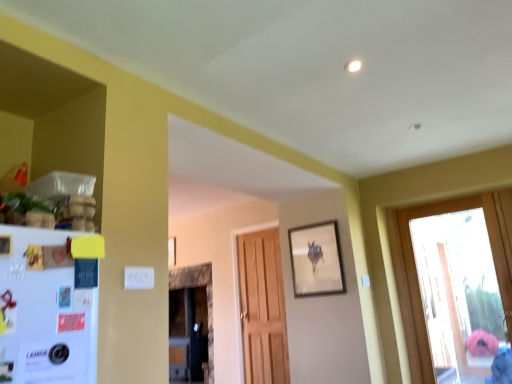
Question: Is transparent glass door at right bigger than white matte refrigerator at left?

Choices:
 (A) no
 (B) yes

Answer: (B)

Question: From a real-world perspective, is transparent glass door at right below white matte refrigerator at left?

Choices:
 (A) yes
 (B) no

Answer: (A)

Question: Is white matte refrigerator at left inside transparent glass door at right?

Choices:
 (A) yes
 (B) no

Answer: (B)

Question: From the image's perspective, is transparent glass door at right beneath white matte refrigerator at left?

Choices:
 (A) no
 (B) yes

Answer: (B)

Question: Is transparent glass door at right completely or partially outside of white matte refrigerator at left?

Choices:
 (A) no
 (B) yes

Answer: (B)

Question: Is transparent glass door at right smaller than white matte refrigerator at left?

Choices:
 (A) no
 (B) yes

Answer: (A)

Question: Is the depth of white matte refrigerator at left greater than that of matte wooden picture frame at center, placed as the first picture frame when sorted from left to right?

Choices:
 (A) no
 (B) yes

Answer: (A)

Question: Can you confirm if white matte refrigerator at left is wider than matte wooden picture frame at center, the second picture frame when ordered from right to left?

Choices:
 (A) yes
 (B) no

Answer: (A)

Question: Does white matte refrigerator at left have a lesser width compared to matte wooden picture frame at center, the second picture frame when ordered from right to left?

Choices:
 (A) yes
 (B) no

Answer: (B)

Question: Can you confirm if white matte refrigerator at left is positioned to the left of matte wooden picture frame at center, placed as the first picture frame when sorted from left to right?

Choices:
 (A) yes
 (B) no

Answer: (B)

Question: Is white matte refrigerator at left to the right of matte wooden picture frame at center, which ranks as the 2th picture frame in front-to-back order, from the viewer's perspective?

Choices:
 (A) yes
 (B) no

Answer: (A)

Question: Is white matte refrigerator at left in front of matte wooden picture frame at center, which ranks as the 2th picture frame in front-to-back order?

Choices:
 (A) no
 (B) yes

Answer: (B)

Question: Could matte wooden picture frame at upper center, which is the second picture frame from left to right, be considered to be inside transparent glass door at right?

Choices:
 (A) yes
 (B) no

Answer: (B)